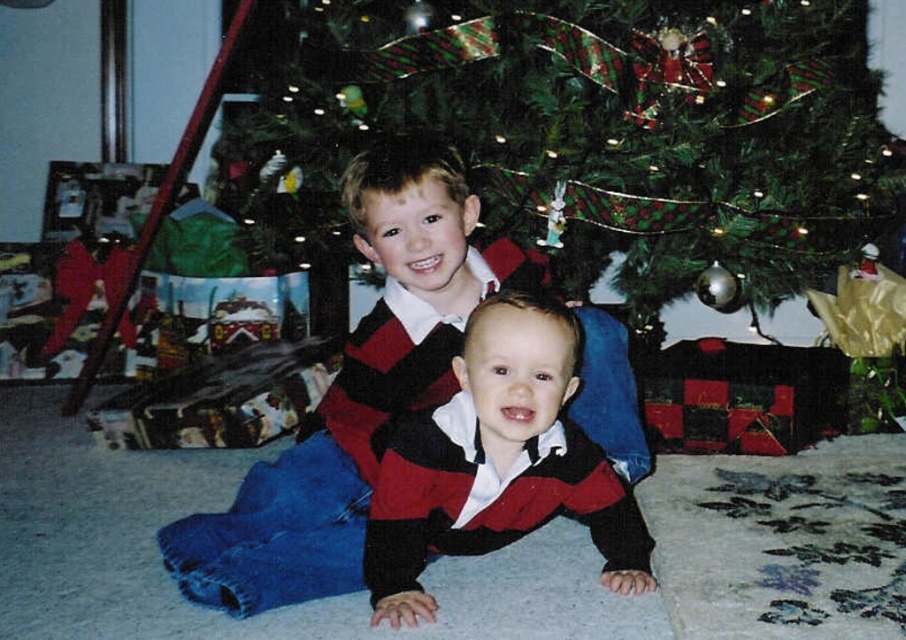
Question: Which point is farther to the camera?

Choices:
 (A) (445, 422)
 (B) (670, 65)

Answer: (B)

Question: Does green textured christmas tree at upper center have a lesser width compared to knit sweater at center?

Choices:
 (A) yes
 (B) no

Answer: (B)

Question: Based on their relative distances, which object is farther from the matte red sweater at center?

Choices:
 (A) green textured christmas tree at upper center
 (B) knit sweater at center

Answer: (A)

Question: Where is matte red sweater at center located in relation to knit sweater at center in the image?

Choices:
 (A) right
 (B) left

Answer: (B)

Question: Which object is positioned closest to the green textured christmas tree at upper center?

Choices:
 (A) matte red sweater at center
 (B) knit sweater at center

Answer: (A)

Question: Can you confirm if matte red sweater at center is smaller than knit sweater at center?

Choices:
 (A) yes
 (B) no

Answer: (B)